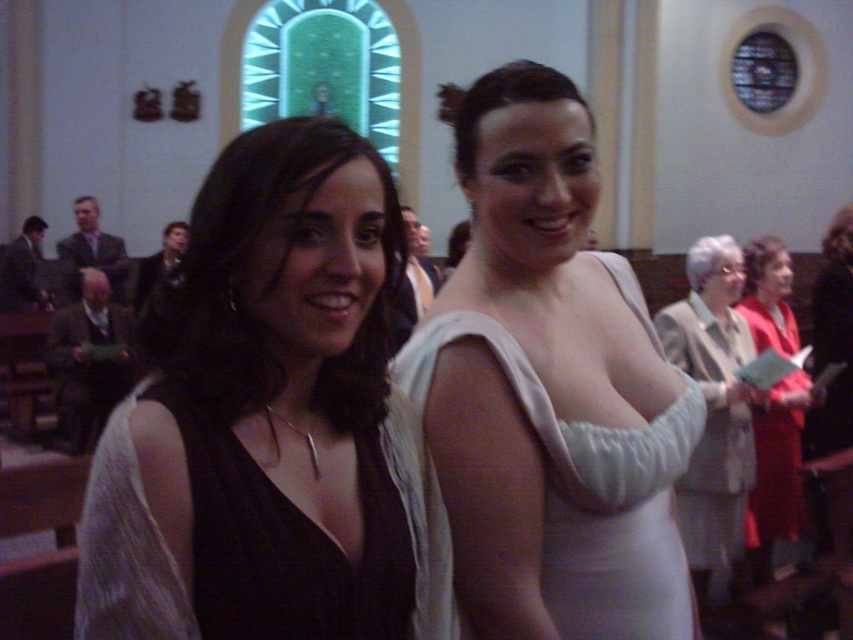
Question: Can you confirm if white satin dress at center is positioned to the left of light beige fabric dress at center?

Choices:
 (A) yes
 (B) no

Answer: (A)

Question: Which point appears farthest from the camera in this image?

Choices:
 (A) (750, 428)
 (B) (251, 588)

Answer: (A)

Question: Where is matte black dress at center located in relation to red satin dress at right in the image?

Choices:
 (A) left
 (B) right

Answer: (A)

Question: Which point appears closest to the camera in this image?

Choices:
 (A) (206, 529)
 (B) (660, 548)

Answer: (A)

Question: Is black satin dress at center wider than red satin dress at right?

Choices:
 (A) no
 (B) yes

Answer: (B)

Question: Which point is farther to the camera?

Choices:
 (A) (759, 326)
 (B) (703, 356)
 (C) (494, 68)

Answer: (C)